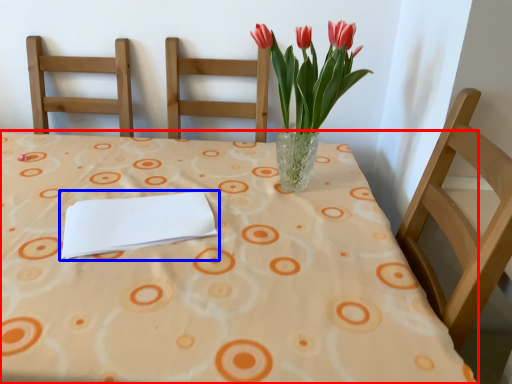
Question: Which object appears farthest to the camera in this image, table (highlighted by a red box) or journal (highlighted by a blue box)?

Choices:
 (A) table
 (B) journal

Answer: (B)